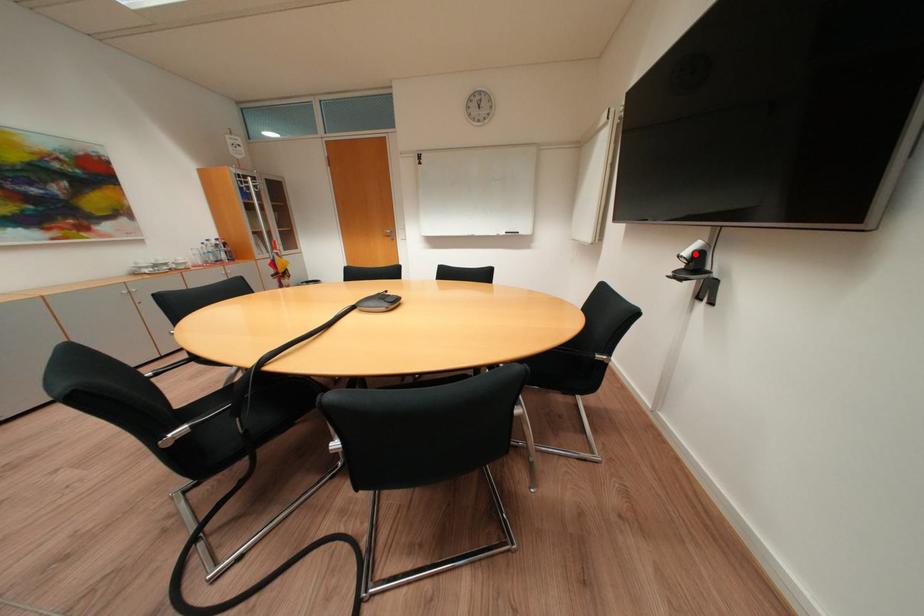
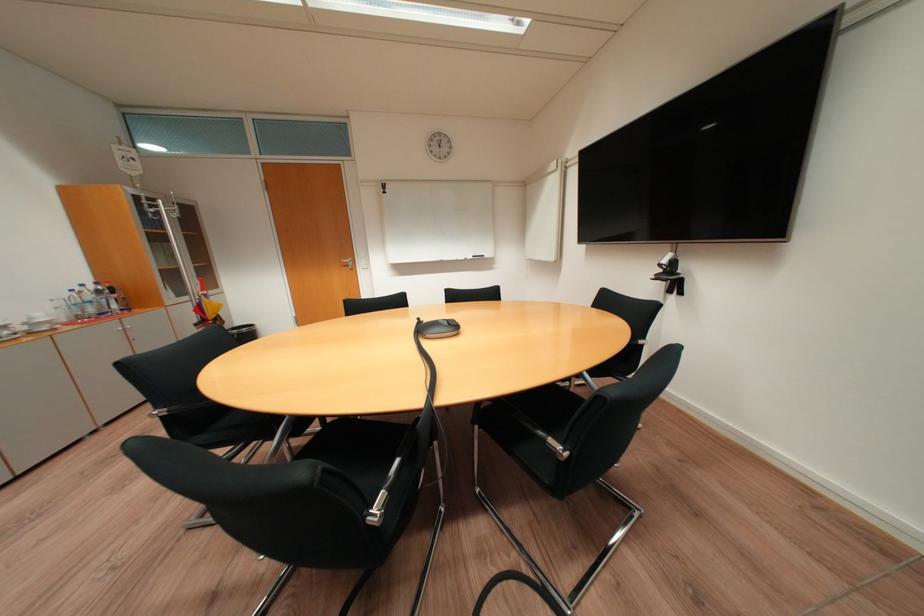
Locate, in the second image, the point that corresponds to the highlighted location in the first image.

(673, 262)